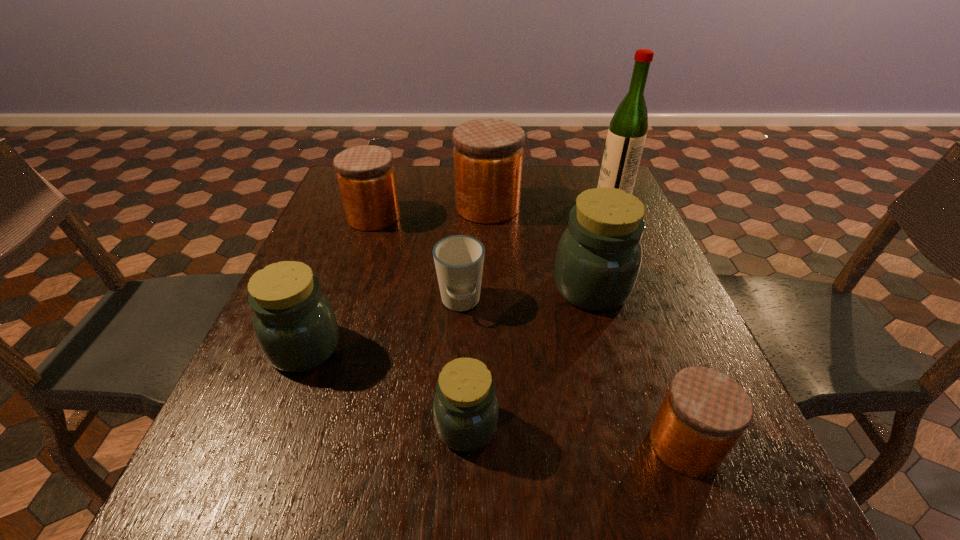
At what (x,y) coordinates should I click in order to perform the action: click on the nearest green jar. Please return your answer as a coordinate pair (x, y). Image resolution: width=960 pixels, height=540 pixels. Looking at the image, I should click on (465, 409).

Identify the location of the rightmost orange jar. (704, 413).

Identify the location of the smallest orange jar. The image size is (960, 540). (704, 413).

This screenshot has height=540, width=960. In order to click on vacant position located on the label of the tallest object in this screenshot , I will do `click(463, 196)`.

Identify the location of vacant point located on the label of the tallest object. The image size is (960, 540). (496, 196).

In order to click on vacant region located on the label of the tallest object in this screenshot , I will do `click(560, 196)`.

Where is `vacant area situated on the front of the biggest orange jar`? vacant area situated on the front of the biggest orange jar is located at coordinates (490, 278).

Locate an element on the screen. The width and height of the screenshot is (960, 540). vacant space situated on the back of the rightmost green jar is located at coordinates (573, 222).

You are a GUI agent. You are given a task and a screenshot of the screen. Output one action in this format:
    pyautogui.click(x=<x>, y=<y>)
    Task: Click on the vacant space located on the right of the second smallest orange jar
    The image size is (960, 540).
    Given the screenshot: What is the action you would take?
    pyautogui.click(x=422, y=217)

Where is `blank area located 0.070m on the right of the third nearest jar`? blank area located 0.070m on the right of the third nearest jar is located at coordinates (376, 348).